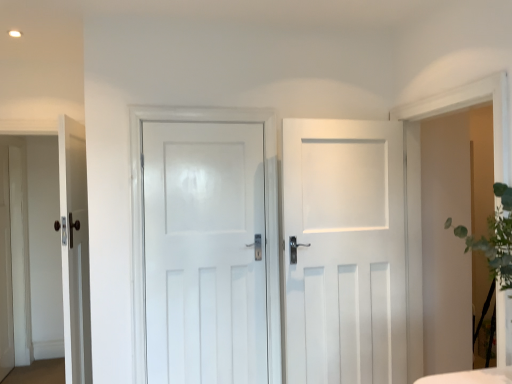
What is the approximate height of matte white door at left, the first door when ordered from left to right?

1.79 meters.

What do you see at coordinates (75, 251) in the screenshot? Image resolution: width=512 pixels, height=384 pixels. I see `matte white door at left, positioned as the third door in right-to-left order` at bounding box center [75, 251].

Where is `white glossy door at center, the 2th door when ordered from left to right`? Image resolution: width=512 pixels, height=384 pixels. white glossy door at center, the 2th door when ordered from left to right is located at coordinates (205, 252).

This screenshot has width=512, height=384. What are the coordinates of `matte white door at left, the first door when ordered from left to right` in the screenshot? It's located at (75, 251).

Which is behind, point (59, 183) or point (208, 372)?

The point (59, 183) is more distant.

In the scene shown: Considering the sizes of matte white door at left, positioned as the third door in right-to-left order, and white glossy door at center, the 2th door when ordered from left to right, in the image, is matte white door at left, positioned as the third door in right-to-left order, taller or shorter than white glossy door at center, the 2th door when ordered from left to right,?

matte white door at left, positioned as the third door in right-to-left order, is taller than white glossy door at center, the 2th door when ordered from left to right.

Does matte white door at left, positioned as the third door in right-to-left order, have a smaller size compared to white glossy door at center, the 2th door when ordered from left to right?

No.

Is matte white door at left, positioned as the third door in right-to-left order, at the left side of white glossy door at center, the 2th door when ordered from left to right?

Correct, you'll find matte white door at left, positioned as the third door in right-to-left order, to the left of white glossy door at center, the 2th door when ordered from left to right.

From their relative heights in the image, would you say white matte door at center, which ranks as the first door in right-to-left order, is taller or shorter than matte white door at left, positioned as the third door in right-to-left order?

Considering their sizes, white matte door at center, which ranks as the first door in right-to-left order, has less height than matte white door at left, positioned as the third door in right-to-left order.

Does white matte door at center, which ranks as the first door in right-to-left order, have a lesser width compared to matte white door at left, positioned as the third door in right-to-left order?

Correct, the width of white matte door at center, which ranks as the first door in right-to-left order, is less than that of matte white door at left, positioned as the third door in right-to-left order.

Looking at this image, how distant is white matte door at center, which is the third door in left-to-right order, from matte white door at left, the first door when ordered from left to right?

white matte door at center, which is the third door in left-to-right order, is 1.41 meters away from matte white door at left, the first door when ordered from left to right.

Who is bigger, white matte door at center, which is the third door in left-to-right order, or matte white door at left, positioned as the third door in right-to-left order?

matte white door at left, positioned as the third door in right-to-left order, is bigger.

Is matte white door at left, the first door when ordered from left to right, looking in the opposite direction of white matte door at center, which is the third door in left-to-right order?

Yes, white matte door at center, which is the third door in left-to-right order, is at the back of matte white door at left, the first door when ordered from left to right.

From the image's perspective, which one is positioned lower, matte white door at left, the first door when ordered from left to right, or white matte door at center, which is the third door in left-to-right order?

matte white door at left, the first door when ordered from left to right, from the image's perspective.

Between matte white door at left, positioned as the third door in right-to-left order, and white matte door at center, which is the third door in left-to-right order, which one has smaller size?

white matte door at center, which is the third door in left-to-right order.

Is matte white door at left, positioned as the third door in right-to-left order, in contact with white matte door at center, which ranks as the first door in right-to-left order?

No, matte white door at left, positioned as the third door in right-to-left order, is not making contact with white matte door at center, which ranks as the first door in right-to-left order.

Which object is wider, white glossy door at center, marked as the second door in a right-to-left arrangement, or white matte door at center, which ranks as the first door in right-to-left order?

white matte door at center, which ranks as the first door in right-to-left order, is wider.

Which of these two, white glossy door at center, marked as the second door in a right-to-left arrangement, or white matte door at center, which is the third door in left-to-right order, is smaller?

With smaller size is white glossy door at center, marked as the second door in a right-to-left arrangement.

From the image's perspective, which is above, white glossy door at center, marked as the second door in a right-to-left arrangement, or white matte door at center, which ranks as the first door in right-to-left order?

white glossy door at center, marked as the second door in a right-to-left arrangement, is shown above in the image.

Considering the sizes of objects white glossy door at center, the 2th door when ordered from left to right, and white matte door at center, which ranks as the first door in right-to-left order, in the image provided, who is taller, white glossy door at center, the 2th door when ordered from left to right, or white matte door at center, which ranks as the first door in right-to-left order,?

Standing taller between the two is white matte door at center, which ranks as the first door in right-to-left order.

From a real-world perspective, relative to matte white door at left, the first door when ordered from left to right, is white glossy door at center, the 2th door when ordered from left to right, vertically above or below?

white glossy door at center, the 2th door when ordered from left to right, is situated higher than matte white door at left, the first door when ordered from left to right, in the real world.

Considering their positions, is white glossy door at center, marked as the second door in a right-to-left arrangement, located in front of or behind matte white door at left, the first door when ordered from left to right?

Clearly, white glossy door at center, marked as the second door in a right-to-left arrangement, is behind matte white door at left, the first door when ordered from left to right.

Does white glossy door at center, the 2th door when ordered from left to right, touch matte white door at left, positioned as the third door in right-to-left order?

No.

From the image's perspective, which one is positioned lower, white glossy door at center, marked as the second door in a right-to-left arrangement, or matte white door at left, positioned as the third door in right-to-left order?

matte white door at left, positioned as the third door in right-to-left order, appears lower in the image.

Based on the photo, how much distance is there between white matte door at center, which is the third door in left-to-right order, and white glossy door at center, the 2th door when ordered from left to right?

white matte door at center, which is the third door in left-to-right order, is 19.04 inches away from white glossy door at center, the 2th door when ordered from left to right.

Is white matte door at center, which ranks as the first door in right-to-left order, facing away from white glossy door at center, the 2th door when ordered from left to right?

No, white glossy door at center, the 2th door when ordered from left to right, is not at the back of white matte door at center, which ranks as the first door in right-to-left order.

Considering the relative positions of white matte door at center, which ranks as the first door in right-to-left order, and white glossy door at center, marked as the second door in a right-to-left arrangement, in the image provided, is white matte door at center, which ranks as the first door in right-to-left order, to the right of white glossy door at center, marked as the second door in a right-to-left arrangement, from the viewer's perspective?

Yes, white matte door at center, which ranks as the first door in right-to-left order, is to the right of white glossy door at center, marked as the second door in a right-to-left arrangement.

At what (x,y) coordinates should I click in order to perform the action: click on door that is the 2nd object located above the matte white door at left, the first door when ordered from left to right (from the image's perspective). Please return your answer as a coordinate pair (x, y). Looking at the image, I should click on (205, 252).

Identify the location of the 2nd door counting from the left side of the white matte door at center, which ranks as the first door in right-to-left order. (75, 251).

Consider the image. Which object lies nearer to the anchor point matte white door at left, positioned as the third door in right-to-left order, white glossy door at center, the 2th door when ordered from left to right, or white matte door at center, which ranks as the first door in right-to-left order?

The object closer to matte white door at left, positioned as the third door in right-to-left order, is white glossy door at center, the 2th door when ordered from left to right.

From the image, which object appears to be farther from white glossy door at center, marked as the second door in a right-to-left arrangement, matte white door at left, the first door when ordered from left to right, or white matte door at center, which ranks as the first door in right-to-left order?

The object further to white glossy door at center, marked as the second door in a right-to-left arrangement, is matte white door at left, the first door when ordered from left to right.

Based on their spatial positions, is white matte door at center, which is the third door in left-to-right order, or matte white door at left, positioned as the third door in right-to-left order, closer to white glossy door at center, marked as the second door in a right-to-left arrangement?

white matte door at center, which is the third door in left-to-right order.

Estimate the real-world distances between objects in this image. Which object is closer to matte white door at left, the first door when ordered from left to right, white matte door at center, which is the third door in left-to-right order, or white glossy door at center, the 2th door when ordered from left to right?

Based on the image, white glossy door at center, the 2th door when ordered from left to right, appears to be nearer to matte white door at left, the first door when ordered from left to right.

Based on their spatial positions, is white glossy door at center, marked as the second door in a right-to-left arrangement, or matte white door at left, positioned as the third door in right-to-left order, closer to white matte door at center, which ranks as the first door in right-to-left order?

Based on the image, white glossy door at center, marked as the second door in a right-to-left arrangement, appears to be nearer to white matte door at center, which ranks as the first door in right-to-left order.

Estimate the real-world distances between objects in this image. Which object is further from white matte door at center, which ranks as the first door in right-to-left order, matte white door at left, positioned as the third door in right-to-left order, or white glossy door at center, marked as the second door in a right-to-left arrangement?

Among the two, matte white door at left, positioned as the third door in right-to-left order, is located further to white matte door at center, which ranks as the first door in right-to-left order.

This screenshot has height=384, width=512. What are the coordinates of `door between matte white door at left, positioned as the third door in right-to-left order, and white matte door at center, which is the third door in left-to-right order, in the horizontal direction` in the screenshot? It's located at (205, 252).